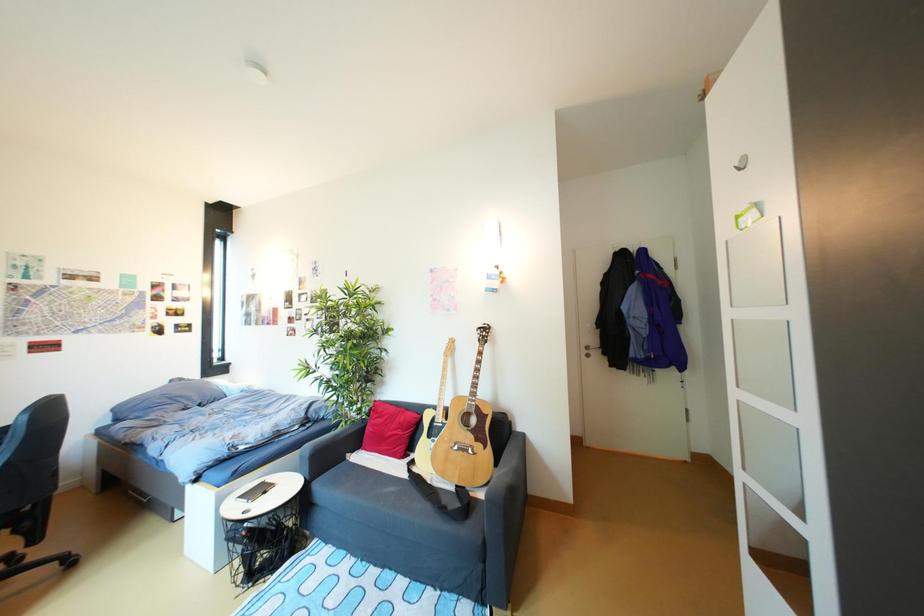
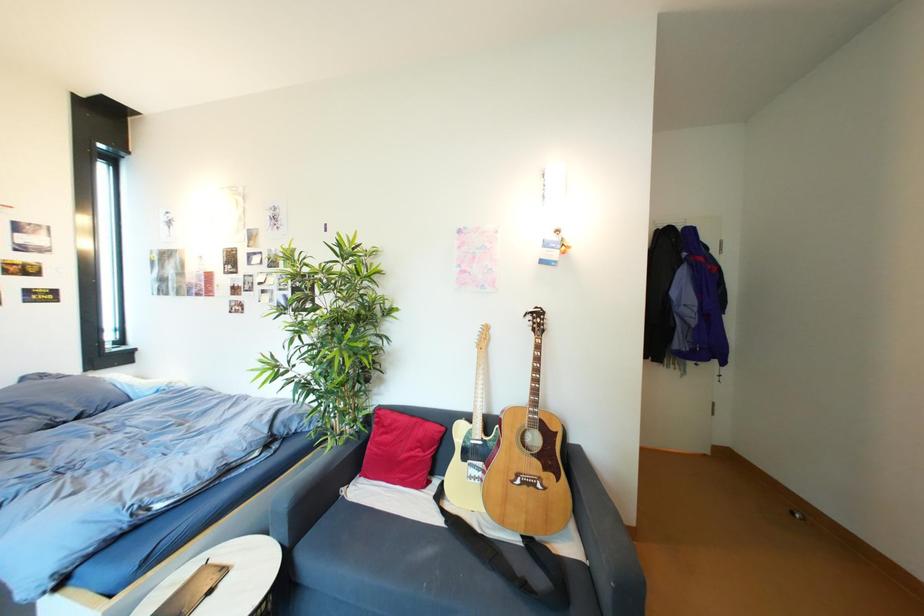
Question: The camera is either moving clockwise (left) or counter-clockwise (right) around the object. The first image is from the beginning of the video and the second image is from the end. Is the camera moving left or right when shooting the video?

Choices:
 (A) Left
 (B) Right

Answer: (A)